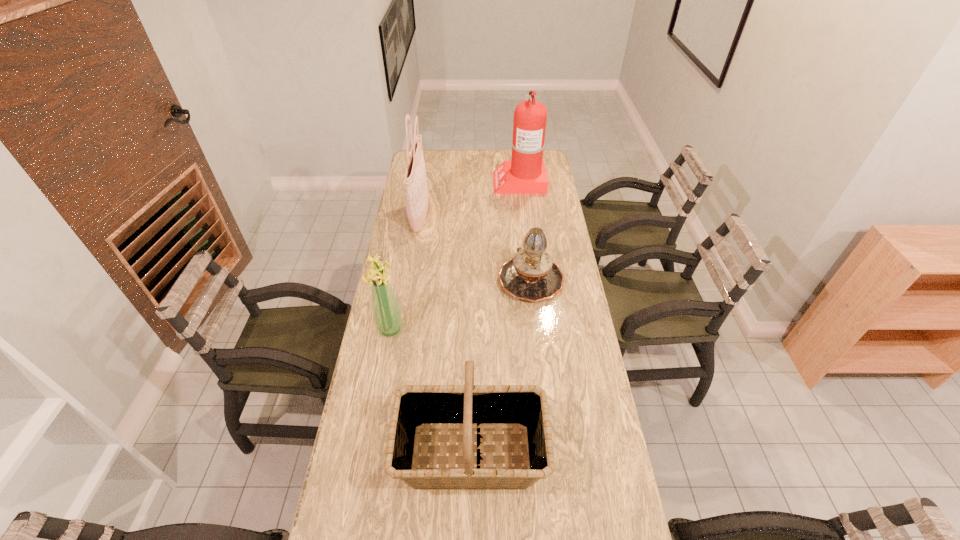
Where is `blank area located on the front-facing side of the fourth farthest object`? This screenshot has width=960, height=540. blank area located on the front-facing side of the fourth farthest object is located at coordinates (496, 329).

What are the coordinates of `vacant space positioned 0.130m by the handle of the nearest object` in the screenshot? It's located at (590, 454).

Find the location of a particular element. Image resolution: width=960 pixels, height=540 pixels. vacant space located 0.200m on the left of the third nearest object is located at coordinates (447, 279).

Locate an element on the screen. object that is at the far edge is located at coordinates (525, 174).

Image resolution: width=960 pixels, height=540 pixels. I want to click on shopping bag present at the left edge, so click(415, 177).

At what (x,y) coordinates should I click in order to perform the action: click on bouquet that is at the left edge. Please return your answer as a coordinate pair (x, y). Looking at the image, I should click on (387, 316).

Locate an element on the screen. This screenshot has height=540, width=960. basket that is positioned at the left edge is located at coordinates (467, 408).

The image size is (960, 540). What are the coordinates of `fire extinguisher that is at the right edge` in the screenshot? It's located at (525, 174).

The image size is (960, 540). What are the coordinates of `oil lamp located at the right edge` in the screenshot? It's located at (531, 275).

Locate an element on the screen. This screenshot has height=540, width=960. object at the far right corner is located at coordinates (525, 174).